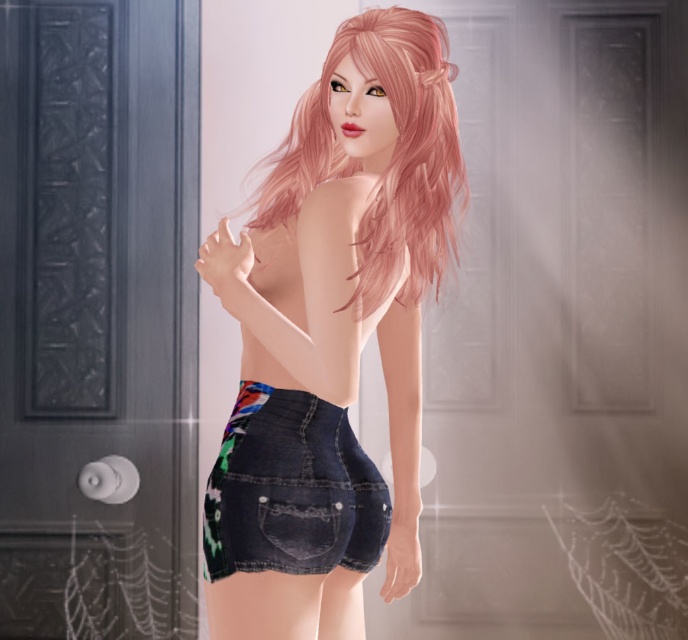
How much distance is there between denim shorts at center and pink wavy hair at back?

They are 4.34 inches apart.

Can you confirm if denim shorts at center is positioned to the right of pink wavy hair at back?

In fact, denim shorts at center is to the left of pink wavy hair at back.

This screenshot has height=640, width=688. What do you see at coordinates (338, 307) in the screenshot?
I see `denim shorts at center` at bounding box center [338, 307].

Where is `denim shorts at center`? denim shorts at center is located at coordinates (338, 307).

Can you confirm if pink wavy hair at back is bigger than denim shorts at lower center?

Yes, pink wavy hair at back is bigger than denim shorts at lower center.

Is point (424, 236) in front of point (268, 442)?

No.

Who is more distant from viewer, (416, 241) or (314, 428)?

The point (416, 241) is more distant.

Identify the location of pink wavy hair at back. This screenshot has height=640, width=688. (391, 154).

Which of these two, denim shorts at center or denim shorts at lower center, stands taller?

With more height is denim shorts at center.

Which of these two, denim shorts at center or denim shorts at lower center, stands shorter?

denim shorts at lower center is shorter.

Between point (270, 600) and point (272, 497), which one is positioned behind?

The point (272, 497) is more distant.

Where is `denim shorts at center`? The width and height of the screenshot is (688, 640). denim shorts at center is located at coordinates 338,307.